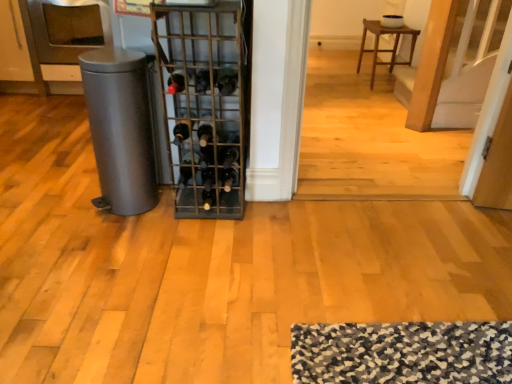
You are a GUI agent. You are given a task and a screenshot of the screen. Output one action in this format:
    pyautogui.click(x=<x>, y=<y>)
    Task: Click on the free spot in front of matte gray trash can at left
    This screenshot has width=512, height=384.
    Given the screenshot: What is the action you would take?
    pyautogui.click(x=114, y=236)